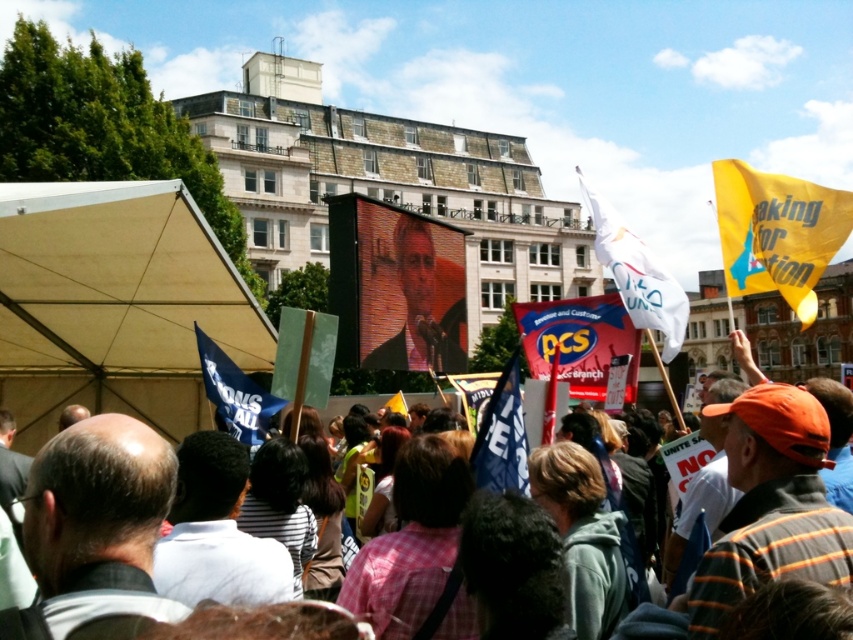
Question: Which object is closer to the camera taking this photo?

Choices:
 (A) smooth skin face at center
 (B) white fabric flag at upper right
 (C) pink fabric banner at center

Answer: (B)

Question: Can you confirm if smooth skin face at center is thinner than white fabric flag at upper right?

Choices:
 (A) yes
 (B) no

Answer: (B)

Question: Is white fabric flag at upper right below blue fabric banner at lower left?

Choices:
 (A) yes
 (B) no

Answer: (B)

Question: Is white fabric flag at upper right thinner than blue fabric flag at center?

Choices:
 (A) no
 (B) yes

Answer: (A)

Question: Which point is closer to the camera?

Choices:
 (A) 370,337
 (B) 486,433

Answer: (B)

Question: Which object is closer to the camera taking this photo?

Choices:
 (A) blue fabric banner at lower left
 (B) white fabric flag at upper right
 (C) pink fabric banner at center

Answer: (A)